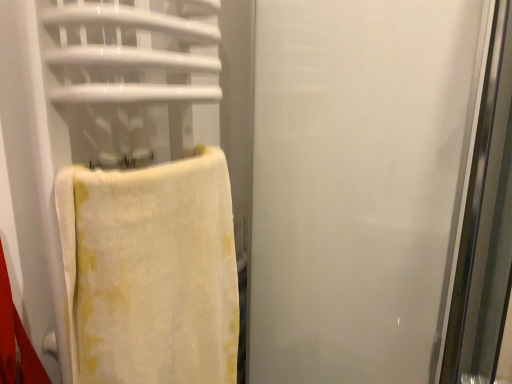
The image size is (512, 384). What do you see at coordinates (360, 184) in the screenshot?
I see `transparent frosted glass screen door at right` at bounding box center [360, 184].

Locate an element on the screen. transparent frosted glass screen door at right is located at coordinates (360, 184).

The image size is (512, 384). Describe the element at coordinates (151, 272) in the screenshot. I see `yellow textured towel at left` at that location.

Where is `yellow textured towel at left`? Image resolution: width=512 pixels, height=384 pixels. yellow textured towel at left is located at coordinates (151, 272).

You are a GUI agent. You are given a task and a screenshot of the screen. Output one action in this format:
    pyautogui.click(x=<x>, y=<y>)
    Task: Click on the transparent frosted glass screen door at right
    This screenshot has width=512, height=384.
    Given the screenshot: What is the action you would take?
    pyautogui.click(x=360, y=184)

Considering the positions of objects transparent frosted glass screen door at right and yellow textured towel at left in the image provided, who is more to the left, transparent frosted glass screen door at right or yellow textured towel at left?

yellow textured towel at left is more to the left.

Is the position of transparent frosted glass screen door at right less distant than that of yellow textured towel at left?

No, transparent frosted glass screen door at right is further to the viewer.

Does point (365, 184) appear closer or farther from the camera than point (172, 325)?

Point (365, 184) is farther from the camera than point (172, 325).

From the image's perspective, is transparent frosted glass screen door at right above yellow textured towel at left?

Yes, from the image's perspective, transparent frosted glass screen door at right is on top of yellow textured towel at left.

From a real-world perspective, relative to yellow textured towel at left, is transparent frosted glass screen door at right vertically above or below?

From a real-world perspective, transparent frosted glass screen door at right is physically above yellow textured towel at left.

Is transparent frosted glass screen door at right wider than yellow textured towel at left?

Indeed, transparent frosted glass screen door at right has a greater width compared to yellow textured towel at left.

Considering the sizes of objects transparent frosted glass screen door at right and yellow textured towel at left in the image provided, who is shorter, transparent frosted glass screen door at right or yellow textured towel at left?

yellow textured towel at left is shorter.

Which of these two, transparent frosted glass screen door at right or yellow textured towel at left, is bigger?

transparent frosted glass screen door at right.

Is transparent frosted glass screen door at right spatially inside yellow textured towel at left, or outside of it?

transparent frosted glass screen door at right is located beyond the bounds of yellow textured towel at left.

Are transparent frosted glass screen door at right and yellow textured towel at left located far from each other?

transparent frosted glass screen door at right is actually quite close to yellow textured towel at left.

Is transparent frosted glass screen door at right positioned with its back to yellow textured towel at left?

No.

How many degrees apart are the facing directions of transparent frosted glass screen door at right and yellow textured towel at left?

transparent frosted glass screen door at right and yellow textured towel at left are facing 90 degrees away from each other.

How far apart are transparent frosted glass screen door at right and yellow textured towel at left?

transparent frosted glass screen door at right is 11.51 inches from yellow textured towel at left.

Find the location of `screen door behind the yellow textured towel at left`. screen door behind the yellow textured towel at left is located at coordinates (360, 184).

Can you confirm if yellow textured towel at left is positioned to the left of transparent frosted glass screen door at right?

Yes.

Between yellow textured towel at left and transparent frosted glass screen door at right, which one is positioned behind?

transparent frosted glass screen door at right is behind.

Which is farther, (155,326) or (389,8)?

The point (389,8) is farther.

From the image's perspective, is yellow textured towel at left positioned above or below transparent frosted glass screen door at right?

From the image's perspective, yellow textured towel at left appears below transparent frosted glass screen door at right.

From a real-world perspective, does yellow textured towel at left stand above transparent frosted glass screen door at right?

No.

Considering the sizes of objects yellow textured towel at left and transparent frosted glass screen door at right in the image provided, who is wider, yellow textured towel at left or transparent frosted glass screen door at right?

transparent frosted glass screen door at right is wider.

Which of these two, yellow textured towel at left or transparent frosted glass screen door at right, stands taller?

With more height is transparent frosted glass screen door at right.

Based on the photo, looking at the image, does yellow textured towel at left seem bigger or smaller compared to transparent frosted glass screen door at right?

Considering their sizes, yellow textured towel at left takes up less space than transparent frosted glass screen door at right.

Consider the image. Does yellow textured towel at left contain transparent frosted glass screen door at right?

No.

Is the surface of yellow textured towel at left in direct contact with transparent frosted glass screen door at right?

yellow textured towel at left and transparent frosted glass screen door at right are clearly separated.

Does yellow textured towel at left turn towards transparent frosted glass screen door at right?

No, yellow textured towel at left does not turn towards transparent frosted glass screen door at right.

How many degrees apart are the facing directions of yellow textured towel at left and transparent frosted glass screen door at right?

90 degrees separate the facing orientations of yellow textured towel at left and transparent frosted glass screen door at right.

The height and width of the screenshot is (384, 512). I want to click on screen door on the right of yellow textured towel at left, so click(x=360, y=184).

Find the location of `towel below the transparent frosted glass screen door at right (from the image's perspective)`. towel below the transparent frosted glass screen door at right (from the image's perspective) is located at coordinates (151, 272).

Where is `screen door that is on the right side of yellow textured towel at left`? The width and height of the screenshot is (512, 384). screen door that is on the right side of yellow textured towel at left is located at coordinates (360, 184).